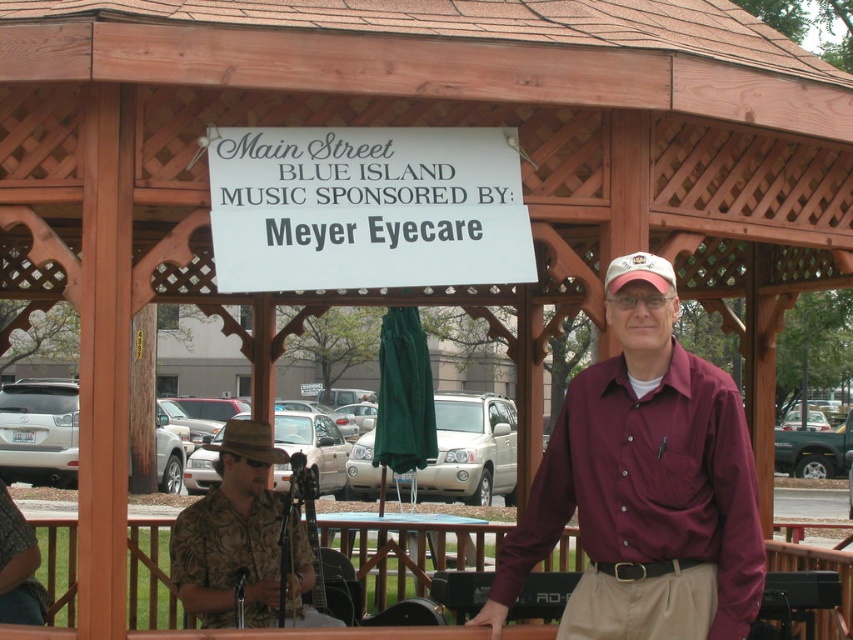
You are a photographer at the event and want to ensure both the camouflage shirt at center and the brown fabric baseball hat at center are clearly visible in your photo. Given their sizes, which object might require you to adjust your framing to prevent it from being too small?

The camouflage shirt at center occupies less space than the brown fabric baseball hat at center, so the camouflage shirt at center might require adjusting the framing to prevent it from being too small.

You are a photographer standing at the edge of the gazebo. You want to take a photo that includes both the white paper sign at center and the white fabric baseball cap at upper center. Given that your camera has a maximum focus range of 4 feet, will you be able to capture both objects clearly in the same shot?

The distance between the white paper sign at center and the white fabric baseball cap at upper center is 4.24 feet, which exceeds the camera maximum focus range of 4 feet. Therefore, you will not be able to capture both objects clearly in the same shot.